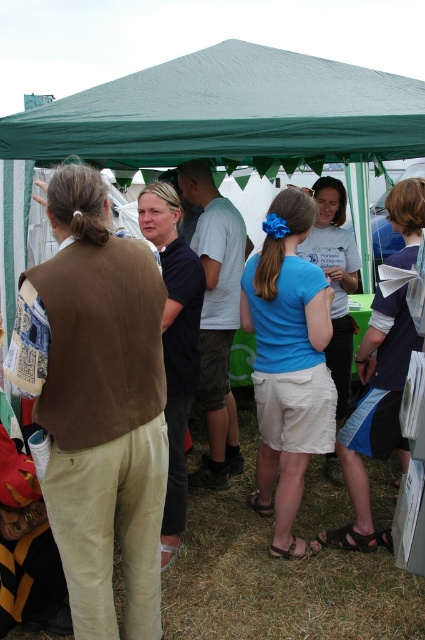
Is point (65, 100) closer to viewer compared to point (223, 205)?

Yes, point (65, 100) is in front of point (223, 205).

Measure the distance between green fabric canopy at upper center and blue fabric tent at center.

The distance of green fabric canopy at upper center from blue fabric tent at center is 1.04 meters.

The height and width of the screenshot is (640, 425). I want to click on green fabric canopy at upper center, so (x=227, y=113).